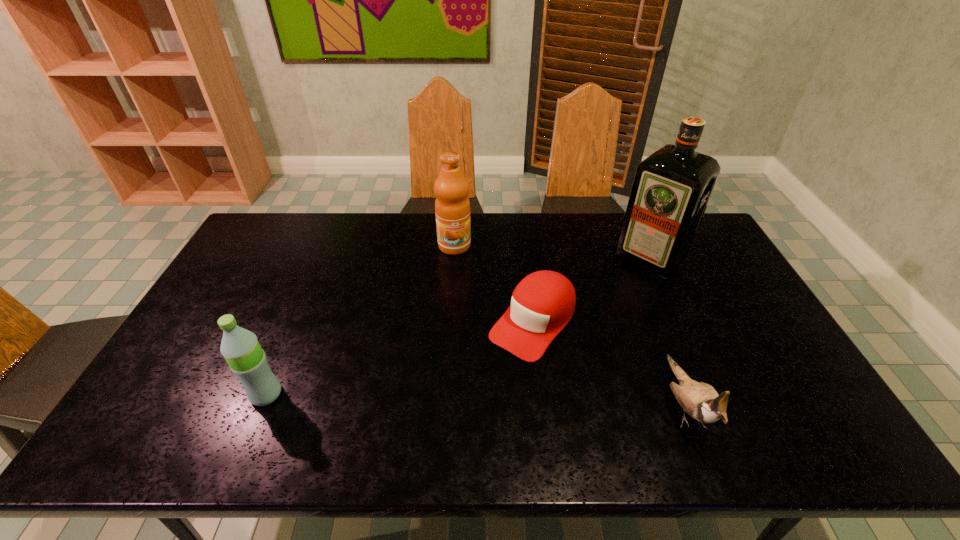
Identify the location of water bottle. (247, 360).

Locate an element on the screen. This screenshot has width=960, height=540. the third tallest object is located at coordinates (247, 360).

Find the location of `bird`. bird is located at coordinates (700, 400).

Where is `the fourth shortest object`? Image resolution: width=960 pixels, height=540 pixels. the fourth shortest object is located at coordinates (452, 206).

Where is `fruit juice`? The image size is (960, 540). fruit juice is located at coordinates (452, 206).

Identify the location of baseball cap. (542, 304).

The width and height of the screenshot is (960, 540). I want to click on the third object from left to right, so click(542, 304).

Identify the location of liquor. This screenshot has width=960, height=540. (671, 189).

What are the coordinates of `blank space located on the back of the water bottle` in the screenshot? It's located at (284, 350).

Image resolution: width=960 pixels, height=540 pixels. Identify the location of free space located 0.200m on the label side of the second tallest object. (459, 297).